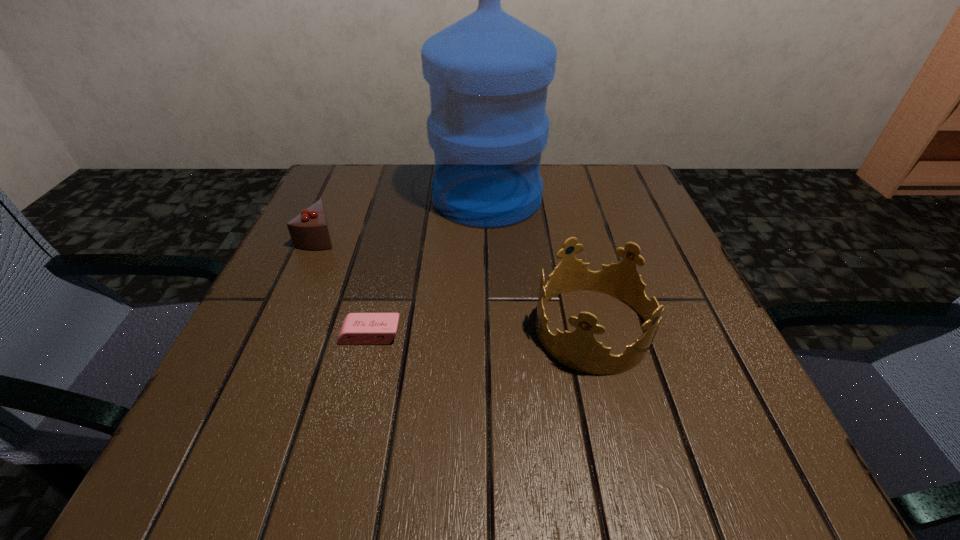
You are a GUI agent. You are given a task and a screenshot of the screen. Output one action in this format:
    pyautogui.click(x=<x>, y=<y>)
    Task: Click on the free space at the far left corner of the desktop
    
    Given the screenshot: What is the action you would take?
    pyautogui.click(x=377, y=191)

At what (x,y) coordinates should I click in order to perform the action: click on free space at the far right corner of the desktop. Please return your answer as a coordinate pair (x, y). This screenshot has height=540, width=960. Looking at the image, I should click on (616, 205).

Where is `blank region between the water jug and the chocolate cake`? Image resolution: width=960 pixels, height=540 pixels. blank region between the water jug and the chocolate cake is located at coordinates (403, 217).

The image size is (960, 540). In order to click on empty space that is in between the third object from right to left and the water jug in this screenshot , I will do `click(429, 266)`.

Where is `free area in between the water jug and the third tallest object`? free area in between the water jug and the third tallest object is located at coordinates (403, 217).

Where is `free space between the second object from left to right and the second tallest object`? This screenshot has width=960, height=540. free space between the second object from left to right and the second tallest object is located at coordinates (482, 332).

In order to click on free space that is in between the leftmost object and the shortest object in this screenshot , I will do `click(345, 285)`.

Locate an element on the screen. This screenshot has width=960, height=540. blank region between the second tallest object and the third object from right to left is located at coordinates (482, 332).

Locate an element on the screen. vacant area that lies between the leftmost object and the second tallest object is located at coordinates (456, 282).

Where is `unoccupied area between the tallest object and the second tallest object`? This screenshot has height=540, width=960. unoccupied area between the tallest object and the second tallest object is located at coordinates 540,263.